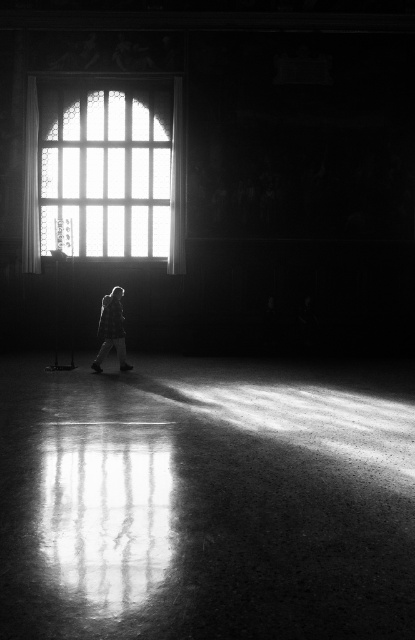
You are standing in the grand hall and want to move from the silvery metallic jacket at center to the clear glass window at upper center. Given that the distance between them is 16.02 feet, how many steps would you need to take if each step covers approximately 2.5 feet?

The distance between the clear glass window at upper center and the silvery metallic jacket at center is 16.02 feet. Since each step covers about 2.5 feet, you would need approximately 7 steps to reach the window.

You are standing in the grand hall and want to walk from the point at coordinates point (95, 99) to the point at coordinates point (107, 314). Which direction should you move relative to the arched window?

Point (95, 99) is behind point (107, 314) relative to the arched window, so you should move towards the arched window to reach point (107, 314) from point (95, 99).